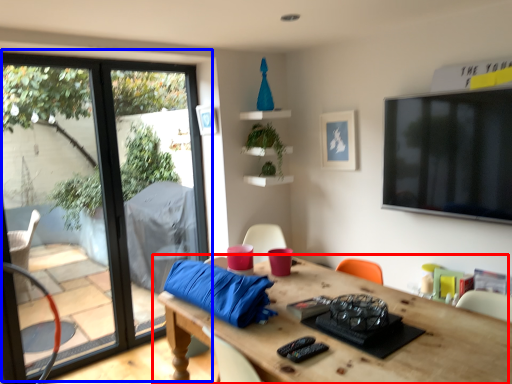
Question: Which point is further to the camera, table (highlighted by a red box) or window (highlighted by a blue box)?

Choices:
 (A) table
 (B) window

Answer: (B)